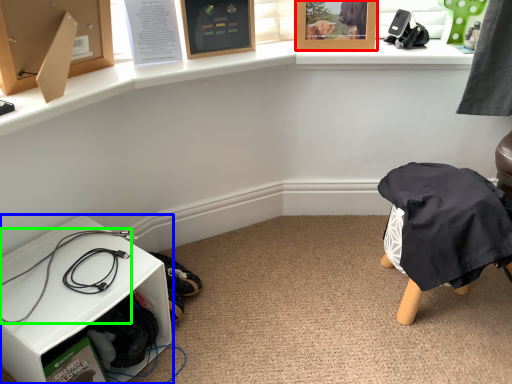
Question: Based on their relative distances, which object is nearer to picture frame (highlighted by a red box)? Choose from furniture (highlighted by a blue box) and wire (highlighted by a green box).

Choices:
 (A) furniture
 (B) wire

Answer: (B)